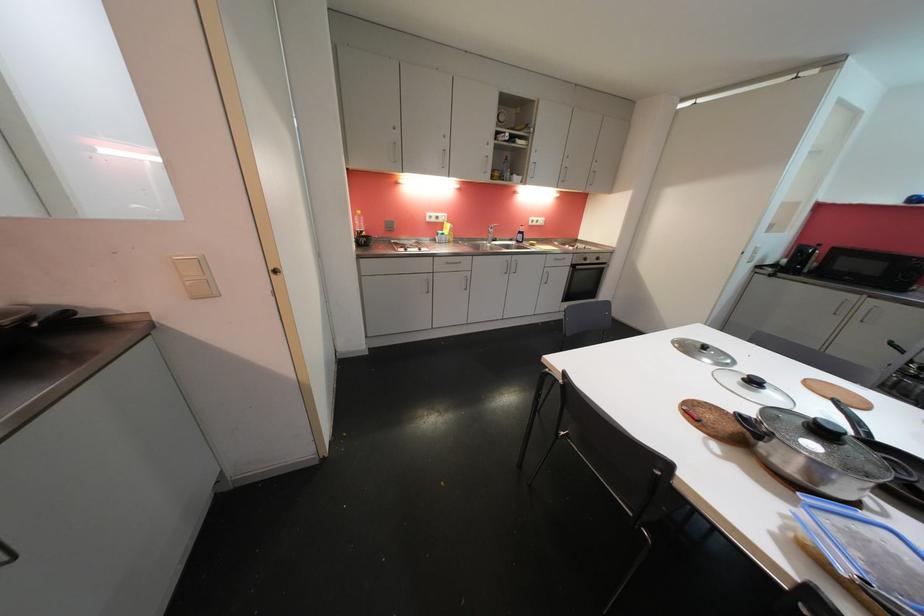
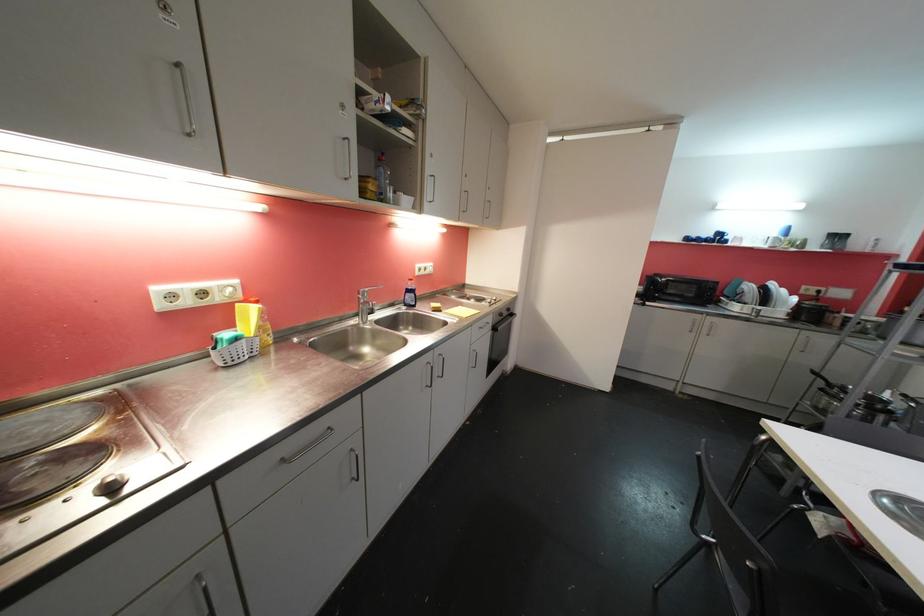
In the second image, find the point that corresponds to point (590, 262) in the first image.

(505, 317)